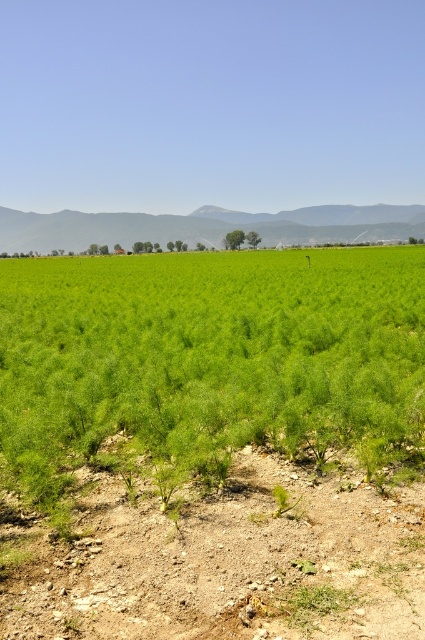
Question: Among these points, which one is farthest from the camera?

Choices:
 (A) coord(255,346)
 (B) coord(295,614)

Answer: (A)

Question: Does green leafy grass at center appear on the left side of dusty brown soil at lower center?

Choices:
 (A) yes
 (B) no

Answer: (A)

Question: In this image, where is green leafy grass at center located relative to dusty brown soil at lower center?

Choices:
 (A) above
 (B) below

Answer: (A)

Question: Does green leafy grass at center lie in front of dusty brown soil at lower center?

Choices:
 (A) no
 (B) yes

Answer: (A)